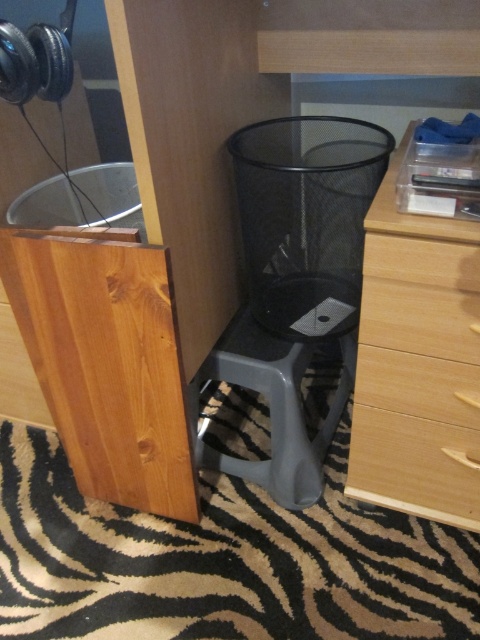
You are standing at the origin of the coordinate system in the room. There are two points marked in the scene, point 1 at (289, 481) and point 2 at (478, 515). Based on your position, which point is closer to you?

Point 2 at (478, 515) is closer to you because it is in front of point 1 at (289, 481).

You are organizing your desk and need to place a tall lamp next to the light brown wood drawer at lower right and the wooden drawer at lower right. Which drawer should you place the lamp next to if it needs to be taller than the drawer?

You should place the lamp next to the wooden drawer at lower right because the light brown wood drawer at lower right is taller than the wooden drawer at lower right, so the lamp needs to be taller than the wooden drawer at lower right to meet the requirement.

You are trying to decide whether to sit on the gray plastic stool at center or the wooden drawer at lower right. Based on their heights, which one is more suitable for sitting?

The gray plastic stool at center is much taller than the wooden drawer at lower right, so it is more suitable for sitting.